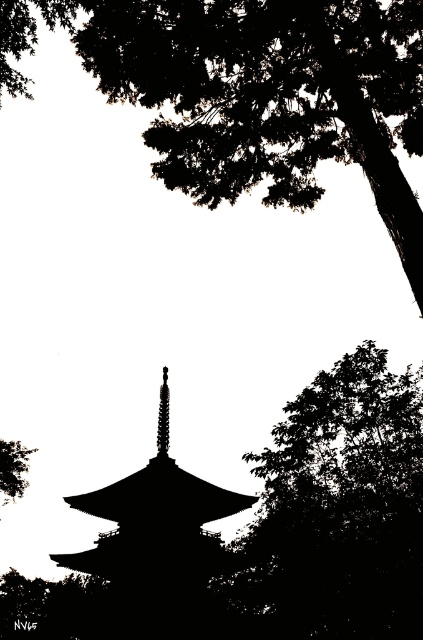
Between green leafy tree at lower left and smooth silver spire at center, which one appears on the right side from the viewer's perspective?

smooth silver spire at center is more to the right.

Does point (7, 460) come behind point (165, 410)?

Yes.

Where is `green leafy tree at lower left`? The height and width of the screenshot is (640, 423). green leafy tree at lower left is located at coordinates (13, 468).

Which is more to the left, silhouette leafy tree at right or dark green leafy tree at center?

Positioned to the left is dark green leafy tree at center.

Where is `silhouette leafy tree at right`? The height and width of the screenshot is (640, 423). silhouette leafy tree at right is located at coordinates (340, 508).

Who is lower down, black matte tower at center or dark green leafy tree at center?

dark green leafy tree at center

Between point (121, 620) and point (54, 636), which one is positioned in front?

Positioned in front is point (121, 620).

Find the location of a particular element. The width and height of the screenshot is (423, 640). black matte tower at center is located at coordinates (156, 547).